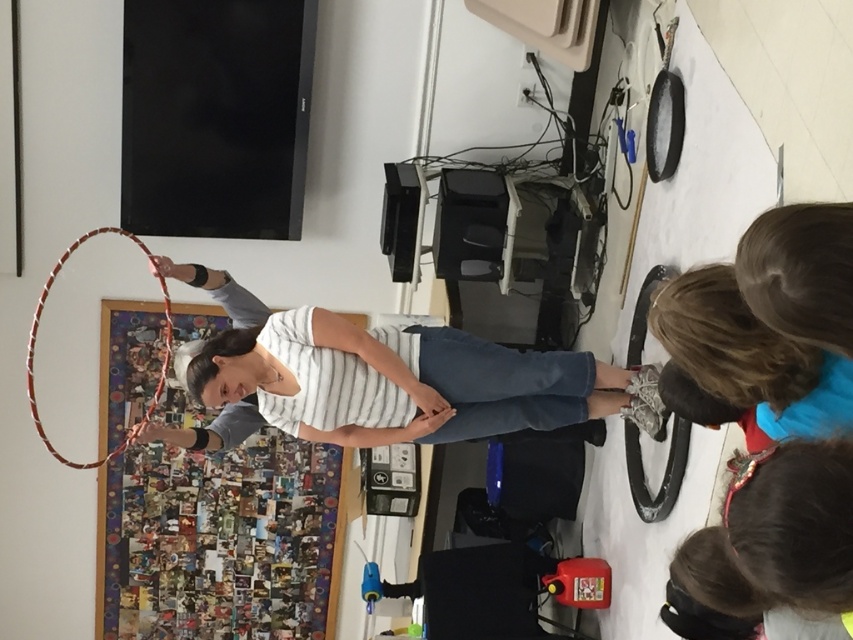
Question: Estimate the real-world distances between objects in this image. Which object is closer to the white striped shirt at center?

Choices:
 (A) smooth brown hair at lower right
 (B) multicolored woven hoop at center

Answer: (B)

Question: Which object is farther from the camera taking this photo?

Choices:
 (A) smooth brown hair at lower right
 (B) white striped shirt at center
 (C) multicolored woven hoop at center

Answer: (C)

Question: Is white striped shirt at center bigger than multicolored woven hoop at center?

Choices:
 (A) yes
 (B) no

Answer: (B)

Question: Among these points, which one is farthest from the camera?

Choices:
 (A) (790, 531)
 (B) (456, 404)
 (C) (44, 291)

Answer: (C)

Question: Does smooth brown hair at lower right lie in front of multicolored woven hoop at center?

Choices:
 (A) yes
 (B) no

Answer: (A)

Question: Is the position of white striped shirt at center less distant than that of smooth brown hair at lower right?

Choices:
 (A) no
 (B) yes

Answer: (A)